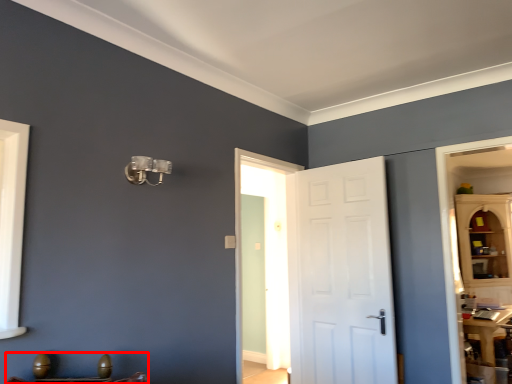
Question: From the image's perspective, what is the correct spatial positioning of furniture (annotated by the red box) in reference to door?

Choices:
 (A) above
 (B) below

Answer: (B)